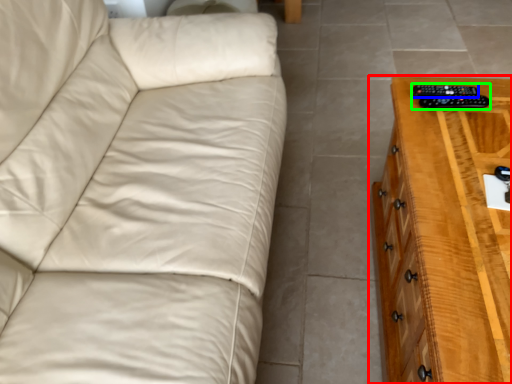
Question: Based on their relative distances, which object is nearer to chest of drawers (highlighted by a red box)? Choose from remote (highlighted by a blue box) and control (highlighted by a green box).

Choices:
 (A) remote
 (B) control

Answer: (B)